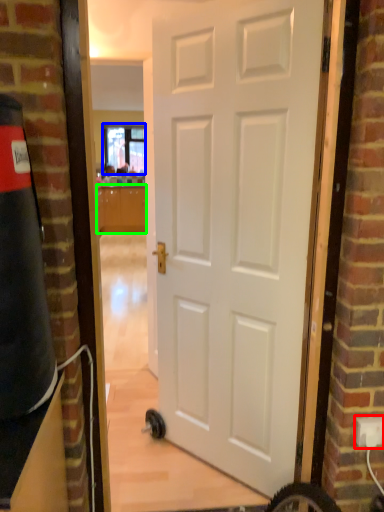
Question: Considering the real-world distances, which object is closest to electric outlet (highlighted by a red box)? window (highlighted by a blue box) or cabinetry (highlighted by a green box).

Choices:
 (A) window
 (B) cabinetry

Answer: (B)